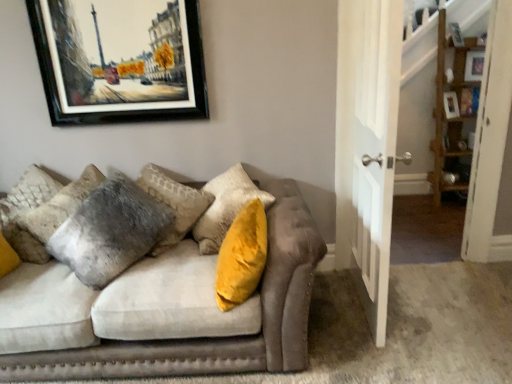
Question: Can we say velvet gray pillow at left lies outside velvet gray couch at center?

Choices:
 (A) no
 (B) yes

Answer: (A)

Question: Does velvet gray pillow at left have a lesser height compared to velvet gray couch at center?

Choices:
 (A) yes
 (B) no

Answer: (B)

Question: Does velvet gray pillow at left come in front of velvet gray couch at center?

Choices:
 (A) yes
 (B) no

Answer: (B)

Question: Is velvet gray pillow at left oriented towards velvet gray couch at center?

Choices:
 (A) no
 (B) yes

Answer: (B)

Question: Is velvet gray couch at center surrounded by velvet gray pillow at left?

Choices:
 (A) yes
 (B) no

Answer: (B)

Question: Considering the relative sizes of velvet gray pillow at left and velvet gray couch at center in the image provided, is velvet gray pillow at left taller than velvet gray couch at center?

Choices:
 (A) yes
 (B) no

Answer: (A)

Question: Is black matte picture frame at upper left wider than white wooden door at center?

Choices:
 (A) no
 (B) yes

Answer: (A)

Question: Can white wooden door at center be found inside black matte picture frame at upper left?

Choices:
 (A) no
 (B) yes

Answer: (A)

Question: Considering the relative sizes of black matte picture frame at upper left and white wooden door at center in the image provided, is black matte picture frame at upper left taller than white wooden door at center?

Choices:
 (A) yes
 (B) no

Answer: (B)

Question: Does black matte picture frame at upper left have a larger size compared to white wooden door at center?

Choices:
 (A) no
 (B) yes

Answer: (A)

Question: Considering the relative positions of black matte picture frame at upper left and white wooden door at center in the image provided, is black matte picture frame at upper left behind white wooden door at center?

Choices:
 (A) no
 (B) yes

Answer: (B)

Question: From the image's perspective, is black matte picture frame at upper left located beneath white wooden door at center?

Choices:
 (A) no
 (B) yes

Answer: (A)

Question: From the image's perspective, is wooden shelf at right located above black matte picture frame at upper left?

Choices:
 (A) yes
 (B) no

Answer: (A)